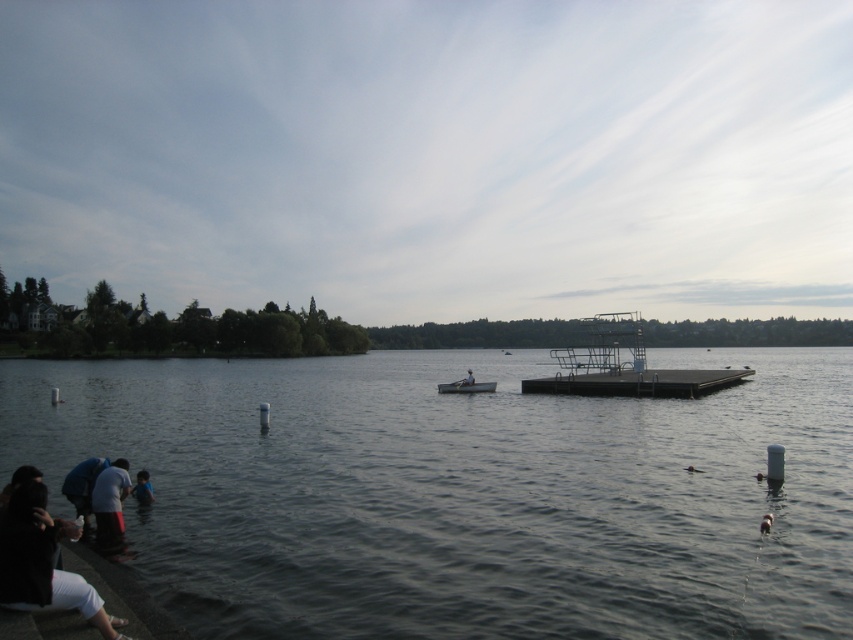
Question: In this image, where is white matte shirt at lower left located relative to smooth skin person at center?

Choices:
 (A) below
 (B) above

Answer: (B)

Question: Which point is farther to the camera?

Choices:
 (A) (471, 380)
 (B) (108, 477)

Answer: (A)

Question: Which of the following is the closest to the observer?

Choices:
 (A) white cotton shirt at lower left
 (B) wooden boat at center
 (C) smooth skin person at center

Answer: (A)

Question: Does dark gray water at lower center come in front of smooth skin person at center?

Choices:
 (A) no
 (B) yes

Answer: (B)

Question: Which is nearer to the white cotton shirt at lower left?

Choices:
 (A) blue fabric at lower left
 (B) white matte shirt at lower left

Answer: (B)

Question: Can you confirm if black metal dock at center is thinner than white matte shirt at lower left?

Choices:
 (A) yes
 (B) no

Answer: (B)